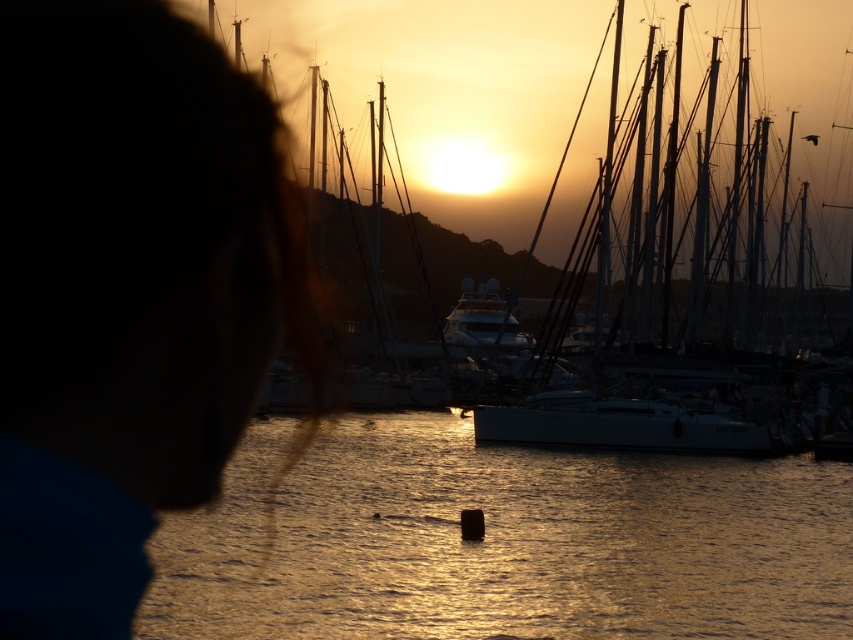
You are a photographer trying to capture the sunset reflection on the water. You notice two elements in the frame, the silky blue hair at upper left and the glossy water at center. Which object is positioned to the left of the other?

The silky blue hair at upper left is positioned to the left of the glossy water at center.

You are a photographer trying to capture the sunset at the marina. You notice the silky blue hair at upper left and the white matte sailboat at center in your viewfinder. Which object is closer to your camera lens?

The silky blue hair at upper left is closer to the camera lens because it is positioned in front of the white matte sailboat at center in the scene.